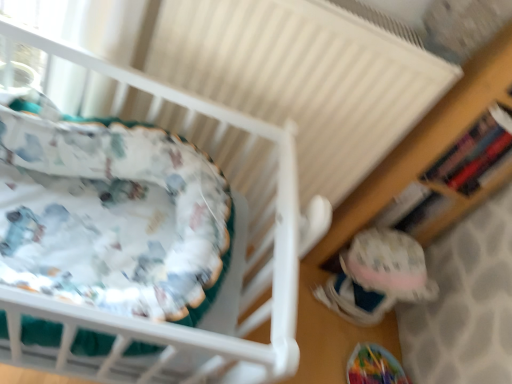
What do you see at coordinates (233, 188) in the screenshot?
I see `white fabric infant bed at left` at bounding box center [233, 188].

Describe the element at coordinates (377, 276) in the screenshot. I see `fuzzy fabric toy at lower right` at that location.

Where is `white fabric infant bed at left`? The height and width of the screenshot is (384, 512). white fabric infant bed at left is located at coordinates (233, 188).

Based on the photo, from a real-world perspective, between wooden bookshelf at right and white textured radiator at upper center, who is vertically higher?

wooden bookshelf at right, from a real-world perspective.

Does wooden bookshelf at right contain white textured radiator at upper center?

No.

How far apart are wooden bookshelf at right and white textured radiator at upper center?

wooden bookshelf at right and white textured radiator at upper center are 31.39 centimeters apart.

Considering the sizes of objects wooden bookshelf at right and white textured radiator at upper center in the image provided, who is wider, wooden bookshelf at right or white textured radiator at upper center?

white textured radiator at upper center is wider.

Can you confirm if white fabric infant bed at left is thinner than wooden bookshelf at right?

In fact, white fabric infant bed at left might be wider than wooden bookshelf at right.

Can you tell me how much white fabric infant bed at left and wooden bookshelf at right differ in facing direction?

4.76 degrees separate the facing orientations of white fabric infant bed at left and wooden bookshelf at right.

Is wooden bookshelf at right inside white fabric infant bed at left?

Actually, wooden bookshelf at right is outside white fabric infant bed at left.

Considering the points (50, 310) and (498, 109), which point is behind, point (50, 310) or point (498, 109)?

The point (498, 109) is farther from the camera.

In the scene shown: Considering the relative sizes of white fabric infant bed at left and fuzzy fabric toy at lower right in the image provided, is white fabric infant bed at left wider than fuzzy fabric toy at lower right?

Yes, white fabric infant bed at left is wider than fuzzy fabric toy at lower right.

Is fuzzy fabric toy at lower right a part of white fabric infant bed at left?

No, fuzzy fabric toy at lower right is not a part of white fabric infant bed at left.

At what (x,y) coordinates should I click in order to perform the action: click on toy on the right of white fabric infant bed at left. Please return your answer as a coordinate pair (x, y). The image size is (512, 384). Looking at the image, I should click on pos(377,276).

Considering the relative sizes of white fabric infant bed at left and fuzzy fabric toy at lower right in the image provided, is white fabric infant bed at left bigger than fuzzy fabric toy at lower right?

Correct, white fabric infant bed at left is larger in size than fuzzy fabric toy at lower right.

Is wooden bookshelf at right beside fuzzy fabric toy at lower right?

No, wooden bookshelf at right is not beside fuzzy fabric toy at lower right.

Image resolution: width=512 pixels, height=384 pixels. In order to click on toy that appears below the wooden bookshelf at right (from a real-world perspective) in this screenshot , I will do click(x=377, y=276).

Consider the image. Is wooden bookshelf at right facing away from fuzzy fabric toy at lower right?

That's not correct — wooden bookshelf at right is not looking away from fuzzy fabric toy at lower right.

Between wooden bookshelf at right and fuzzy fabric toy at lower right, which one is positioned in front?

Positioned in front is wooden bookshelf at right.

Between white fabric infant bed at left and white textured radiator at upper center, which one has smaller width?

With smaller width is white textured radiator at upper center.

Is white fabric infant bed at left next to white textured radiator at upper center and touching it?

No.

From the picture: Is white textured radiator at upper center looking in the opposite direction of fuzzy fabric toy at lower right?

No, white textured radiator at upper center's orientation is not away from fuzzy fabric toy at lower right.

From a real-world perspective, does white textured radiator at upper center sit lower than fuzzy fabric toy at lower right?

No, from a real-world perspective, white textured radiator at upper center is not beneath fuzzy fabric toy at lower right.

Where is `toy below the white textured radiator at upper center (from the image's perspective)`? Image resolution: width=512 pixels, height=384 pixels. toy below the white textured radiator at upper center (from the image's perspective) is located at coordinates (377, 276).

Who is bigger, white textured radiator at upper center or fuzzy fabric toy at lower right?

white textured radiator at upper center is bigger.

Looking at this image, can you confirm if white textured radiator at upper center is positioned to the right of wooden bookshelf at right?

Incorrect, white textured radiator at upper center is not on the right side of wooden bookshelf at right.

Could wooden bookshelf at right be considered to be inside white textured radiator at upper center?

No, wooden bookshelf at right is not inside white textured radiator at upper center.

Is white textured radiator at upper center positioned with its back to wooden bookshelf at right?

No, white textured radiator at upper center's orientation is not away from wooden bookshelf at right.

Is white textured radiator at upper center taller or shorter than wooden bookshelf at right?

Clearly, white textured radiator at upper center is taller compared to wooden bookshelf at right.

Where is `shelf below the white textured radiator at upper center (from the image's perspective)`? The width and height of the screenshot is (512, 384). shelf below the white textured radiator at upper center (from the image's perspective) is located at coordinates (474, 152).

Identify the location of shelf above the white fabric infant bed at left (from a real-world perspective). The image size is (512, 384). (474, 152).

Estimate the real-world distances between objects in this image. Which object is further from wooden bookshelf at right, fuzzy fabric toy at lower right or white textured radiator at upper center?

The object further to wooden bookshelf at right is white textured radiator at upper center.

Which object lies nearer to the anchor point white textured radiator at upper center, white fabric infant bed at left or wooden bookshelf at right?

white fabric infant bed at left is positioned closer to the anchor white textured radiator at upper center.

Based on the photo, which object lies further to the anchor point white textured radiator at upper center, white fabric infant bed at left or fuzzy fabric toy at lower right?

Among the two, fuzzy fabric toy at lower right is located further to white textured radiator at upper center.

Looking at the image, which one is located closer to fuzzy fabric toy at lower right, white fabric infant bed at left or wooden bookshelf at right?

Among the two, wooden bookshelf at right is located nearer to fuzzy fabric toy at lower right.

Which object lies further to the anchor point fuzzy fabric toy at lower right, wooden bookshelf at right or white textured radiator at upper center?

The object further to fuzzy fabric toy at lower right is white textured radiator at upper center.

Looking at the image, which one is located closer to fuzzy fabric toy at lower right, white textured radiator at upper center or white fabric infant bed at left?

Among the two, white fabric infant bed at left is located nearer to fuzzy fabric toy at lower right.

Looking at the image, which one is located further to white textured radiator at upper center, fuzzy fabric toy at lower right or white fabric infant bed at left?

fuzzy fabric toy at lower right is positioned further to the anchor white textured radiator at upper center.

Based on their spatial positions, is wooden bookshelf at right or white fabric infant bed at left closer to white textured radiator at upper center?

Among the two, white fabric infant bed at left is located nearer to white textured radiator at upper center.

Identify the location of toy between white textured radiator at upper center and wooden bookshelf at right. (377, 276).

This screenshot has height=384, width=512. Identify the location of radiator between white fabric infant bed at left and wooden bookshelf at right in the horizontal direction. (302, 77).

This screenshot has height=384, width=512. Identify the location of radiator between white fabric infant bed at left and fuzzy fabric toy at lower right from left to right. (302, 77).

Where is `toy between white fabric infant bed at left and wooden bookshelf at right in the horizontal direction`? This screenshot has height=384, width=512. toy between white fabric infant bed at left and wooden bookshelf at right in the horizontal direction is located at coordinates (377, 276).